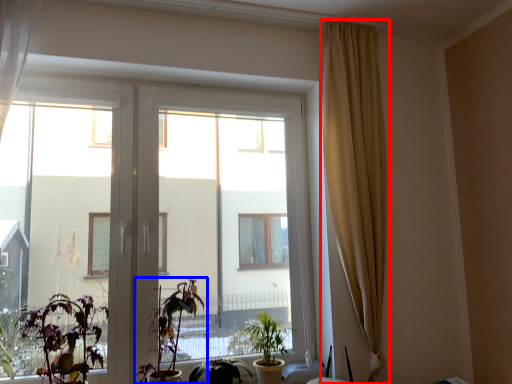
Question: Which object appears closest to the camera in this image, curtain (highlighted by a red box) or houseplant (highlighted by a blue box)?

Choices:
 (A) curtain
 (B) houseplant

Answer: (B)